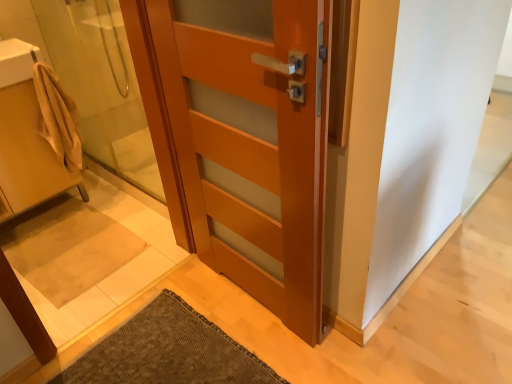
Question: Is white glossy sink at upper left, which ranks as the second sink in bottom-to-top order, bigger than beige fabric bath mat at lower left?

Choices:
 (A) no
 (B) yes

Answer: (A)

Question: Is white glossy sink at upper left, the first sink when ordered from top to bottom, at the right side of beige fabric bath mat at lower left?

Choices:
 (A) no
 (B) yes

Answer: (A)

Question: Are white glossy sink at upper left, the first sink when ordered from top to bottom, and beige fabric bath mat at lower left beside each other?

Choices:
 (A) yes
 (B) no

Answer: (B)

Question: Is beige fabric bath mat at lower left completely or partially inside white glossy sink at upper left, the first sink when ordered from top to bottom?

Choices:
 (A) yes
 (B) no

Answer: (B)

Question: Does white glossy sink at upper left, the first sink when ordered from top to bottom, have a lesser height compared to beige fabric bath mat at lower left?

Choices:
 (A) yes
 (B) no

Answer: (B)

Question: Is beige cotton bathrobe at left bigger or smaller than white glossy sink at upper left, which ranks as the second sink in bottom-to-top order?

Choices:
 (A) big
 (B) small

Answer: (A)

Question: From the image's perspective, is beige cotton bathrobe at left above or below white glossy sink at upper left, the first sink when ordered from top to bottom?

Choices:
 (A) above
 (B) below

Answer: (B)

Question: Is beige cotton bathrobe at left wider or thinner than white glossy sink at upper left, the first sink when ordered from top to bottom?

Choices:
 (A) wide
 (B) thin

Answer: (B)

Question: Considering their positions, is beige cotton bathrobe at left located in front of or behind white glossy sink at upper left, the first sink when ordered from top to bottom?

Choices:
 (A) behind
 (B) front

Answer: (A)

Question: In terms of size, does white glossy sink at upper left, which ranks as the second sink in bottom-to-top order, appear bigger or smaller than matte wood door at center?

Choices:
 (A) big
 (B) small

Answer: (B)

Question: Visually, is white glossy sink at upper left, which ranks as the second sink in bottom-to-top order, positioned to the left or to the right of matte wood door at center?

Choices:
 (A) right
 (B) left

Answer: (B)

Question: From their relative heights in the image, would you say white glossy sink at upper left, which ranks as the second sink in bottom-to-top order, is taller or shorter than matte wood door at center?

Choices:
 (A) tall
 (B) short

Answer: (B)

Question: Which is correct: white glossy sink at upper left, which ranks as the second sink in bottom-to-top order, is inside matte wood door at center, or outside of it?

Choices:
 (A) inside
 (B) outside

Answer: (B)

Question: From a real-world perspective, relative to matte wood door at center, is translucent glass shower door at left vertically above or below?

Choices:
 (A) below
 (B) above

Answer: (A)

Question: Visually, is translucent glass shower door at left positioned to the left or to the right of matte wood door at center?

Choices:
 (A) left
 (B) right

Answer: (A)